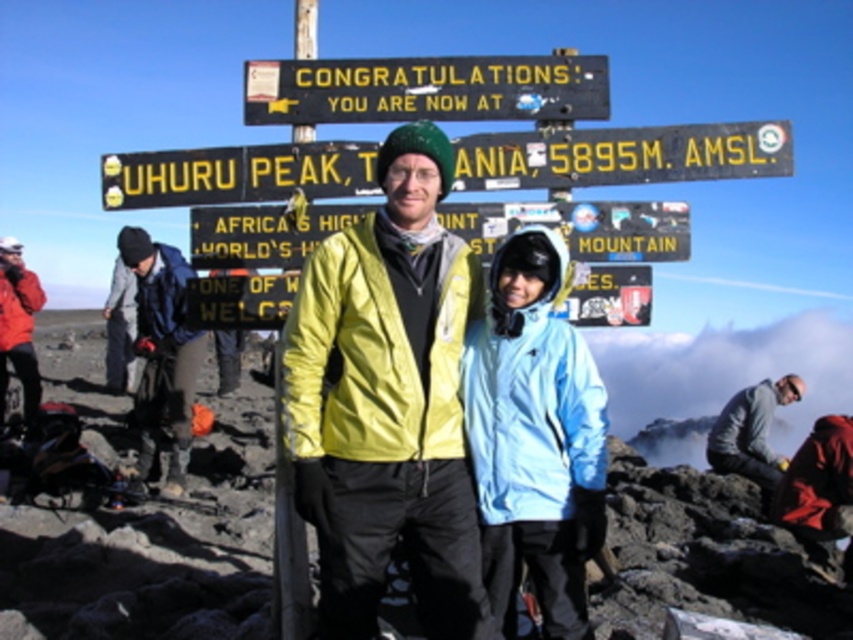
Question: Which object is farther from the camera taking this photo?

Choices:
 (A) gray fabric jacket at lower right
 (B) light blue fabric jacket at center

Answer: (A)

Question: Considering the real-world distances, which object is closest to the light blue fabric jacket at center?

Choices:
 (A) brushed metal jacket at lower left
 (B) black plastic sign at center
 (C) yellow matte jacket at center
 (D) yellow painted wood sign at upper center

Answer: (C)

Question: Is yellow painted wood sign at upper center bigger than gray fabric jacket at lower right?

Choices:
 (A) no
 (B) yes

Answer: (A)

Question: Does light blue fabric jacket at center lie in front of gray fabric jacket at lower right?

Choices:
 (A) no
 (B) yes

Answer: (B)

Question: Does light blue fabric jacket at center have a smaller size compared to black plastic sign at center?

Choices:
 (A) no
 (B) yes

Answer: (B)

Question: Which object appears farthest from the camera in this image?

Choices:
 (A) brushed metal jacket at lower left
 (B) yellow matte jacket at center
 (C) yellow painted wood sign at upper center

Answer: (A)